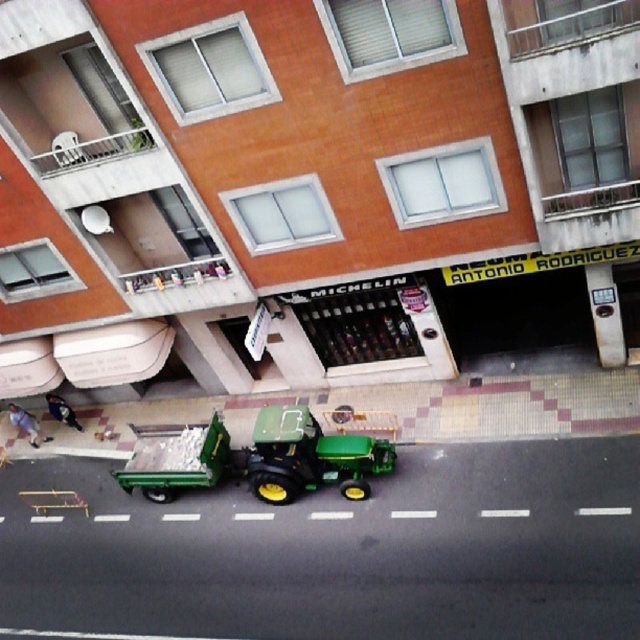
Question: Does green rubber tractor at lower center appear on the right side of light blue jeans at lower left?

Choices:
 (A) yes
 (B) no

Answer: (A)

Question: Does light blue jeans at lower left appear on the left side of dark blue jeans at lower left?

Choices:
 (A) no
 (B) yes

Answer: (B)

Question: Estimate the real-world distances between objects in this image. Which object is closer to the green rubber tractor at lower center?

Choices:
 (A) green rubber tractor at center
 (B) light blue jeans at lower left

Answer: (A)

Question: Which of these objects is positioned closest to the green rubber tractor at center?

Choices:
 (A) dark blue jeans at lower left
 (B) green rubber tractor at lower center
 (C) light blue jeans at lower left

Answer: (B)

Question: Can you confirm if green rubber tractor at center is positioned to the right of dark blue jeans at lower left?

Choices:
 (A) yes
 (B) no

Answer: (A)

Question: Which point is farther from the camera taking this photo?

Choices:
 (A) (144, 492)
 (B) (38, 433)
 (C) (326, 458)

Answer: (B)